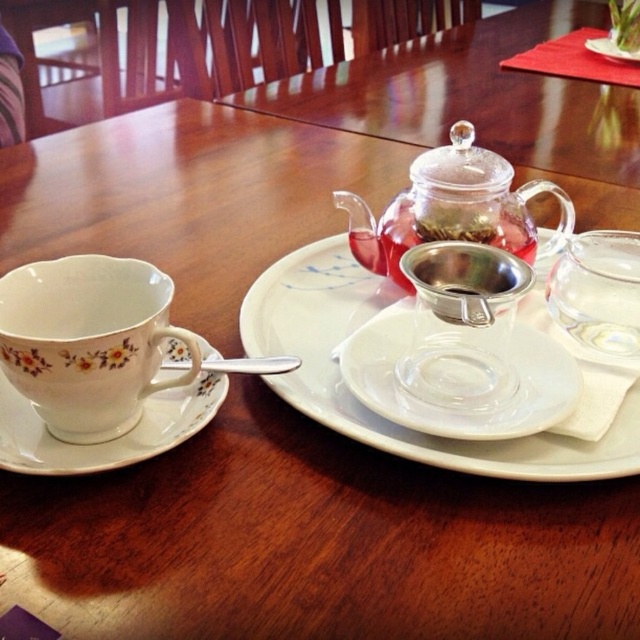
Who is more distant from viewer, (17, 417) or (449, 323)?

The point (17, 417) is more distant.

Measure the distance between point (208, 348) and camera.

14.76 inches

This screenshot has width=640, height=640. Identify the location of white ceramic saucer at left. (108, 440).

Between transparent glass teapot at center and white ceramic saucer at left, which one appears on the right side from the viewer's perspective?

From the viewer's perspective, transparent glass teapot at center appears more on the right side.

Can you confirm if transparent glass teapot at center is positioned below white ceramic saucer at left?

No, transparent glass teapot at center is not below white ceramic saucer at left.

Is point (490, 204) more distant than point (61, 458)?

Yes, point (490, 204) is behind point (61, 458).

Where is `transparent glass teapot at center`? Image resolution: width=640 pixels, height=640 pixels. transparent glass teapot at center is located at coordinates (452, 209).

Which is above, white porcelain platter at center or transparent glass teapot at center?

Positioned higher is transparent glass teapot at center.

Is white porcelain platter at center positioned behind transparent glass teapot at center?

No, it is in front of transparent glass teapot at center.

Where is `white porcelain platter at center`? Image resolution: width=640 pixels, height=640 pixels. white porcelain platter at center is located at coordinates (376, 413).